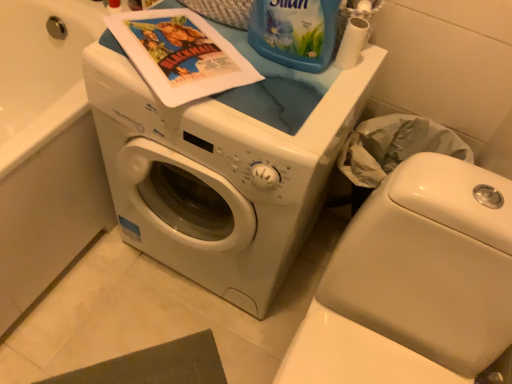
Question: From a real-world perspective, is white matte toilet paper at upper right positioned over blue plastic bottle at upper center based on gravity?

Choices:
 (A) yes
 (B) no

Answer: (B)

Question: Is blue plastic bottle at upper center located within white matte toilet paper at upper right?

Choices:
 (A) no
 (B) yes

Answer: (A)

Question: Is white matte toilet paper at upper right with blue plastic bottle at upper center?

Choices:
 (A) no
 (B) yes

Answer: (B)

Question: Does white matte toilet paper at upper right have a smaller size compared to blue plastic bottle at upper center?

Choices:
 (A) no
 (B) yes

Answer: (B)

Question: Does white matte toilet paper at upper right have a lesser height compared to blue plastic bottle at upper center?

Choices:
 (A) yes
 (B) no

Answer: (A)

Question: From a real-world perspective, is white matte toilet paper at upper right located beneath blue plastic bottle at upper center?

Choices:
 (A) no
 (B) yes

Answer: (B)

Question: From the image's perspective, is white glossy washer at lower left under white glossy washing machine at center?

Choices:
 (A) yes
 (B) no

Answer: (A)

Question: Can you confirm if white glossy washer at lower left is shorter than white glossy washing machine at center?

Choices:
 (A) yes
 (B) no

Answer: (A)

Question: Is white glossy washing machine at center surrounded by white glossy washer at lower left?

Choices:
 (A) no
 (B) yes

Answer: (A)

Question: From the image's perspective, is white glossy washer at lower left on top of white glossy washing machine at center?

Choices:
 (A) yes
 (B) no

Answer: (B)

Question: Is white glossy washer at lower left thinner than white glossy washing machine at center?

Choices:
 (A) yes
 (B) no

Answer: (B)

Question: Is white glossy washer at lower left in contact with white glossy washing machine at center?

Choices:
 (A) no
 (B) yes

Answer: (A)

Question: Is there a large distance between matte paper comic book at upper center and white glossy washing machine at center?

Choices:
 (A) no
 (B) yes

Answer: (A)